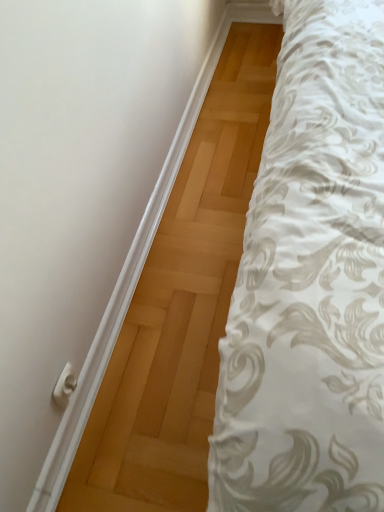
Question: From a real-world perspective, is white plastic door handle at lower left above or below white matte door at upper left?

Choices:
 (A) below
 (B) above

Answer: (B)

Question: Is white plastic door handle at lower left in front of or behind white matte door at upper left in the image?

Choices:
 (A) front
 (B) behind

Answer: (B)

Question: In terms of width, does white plastic door handle at lower left look wider or thinner when compared to white matte door at upper left?

Choices:
 (A) thin
 (B) wide

Answer: (A)

Question: From their relative heights in the image, would you say white matte door at upper left is taller or shorter than white plastic door handle at lower left?

Choices:
 (A) tall
 (B) short

Answer: (B)

Question: In the image, is white matte door at upper left positioned in front of or behind white plastic door handle at lower left?

Choices:
 (A) front
 (B) behind

Answer: (A)

Question: Looking at their shapes, would you say white matte door at upper left is wider or thinner than white plastic door handle at lower left?

Choices:
 (A) wide
 (B) thin

Answer: (A)

Question: From a real-world perspective, is white matte door at upper left above or below white plastic door handle at lower left?

Choices:
 (A) above
 (B) below

Answer: (B)